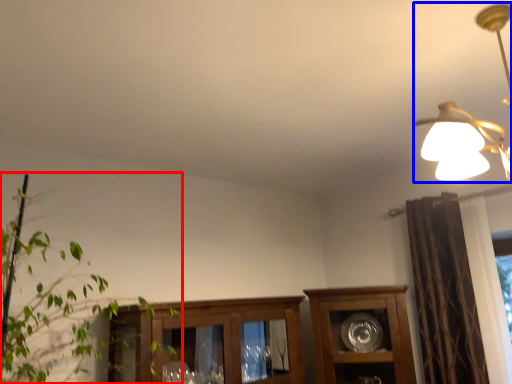
Question: Which of the following is the farthest to the observer, houseplant (highlighted by a red box) or lamp (highlighted by a blue box)?

Choices:
 (A) houseplant
 (B) lamp

Answer: (A)